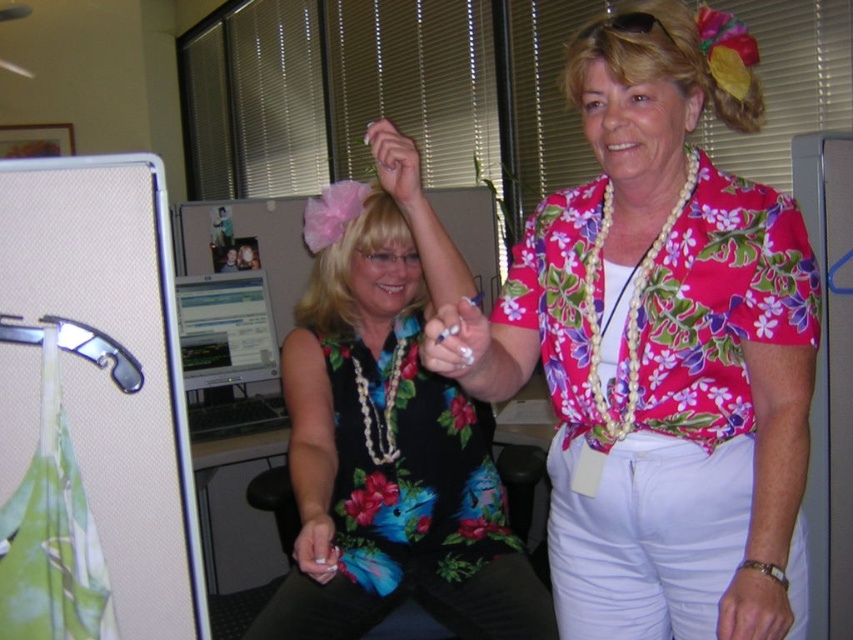
You are an office worker who wants to adjust the height of your monitor to ensure it is positioned correctly for ergonomic purposes. Given the current setup, can you determine if the matte plastic monitor at center is already taller than the blondehair at center?

The matte plastic monitor at center has a greater height compared to blondehair at center, so yes, the monitor is already positioned taller than the blondehair at center.

You are an interior designer assessing the space in the office. You need to place a decorative item between the floral fabric dress at center and the blonde hair at upper right. Considering their sizes, which object should the item be placed closer to?

The floral fabric dress at center has a larger width than the blonde hair at upper right, so the decorative item should be placed closer to the blonde hair at upper right to balance the space.